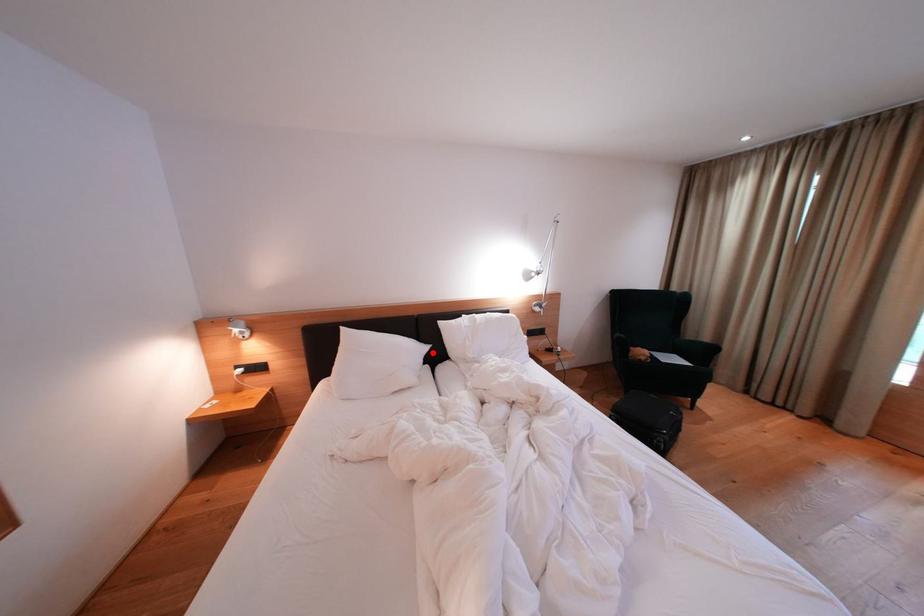
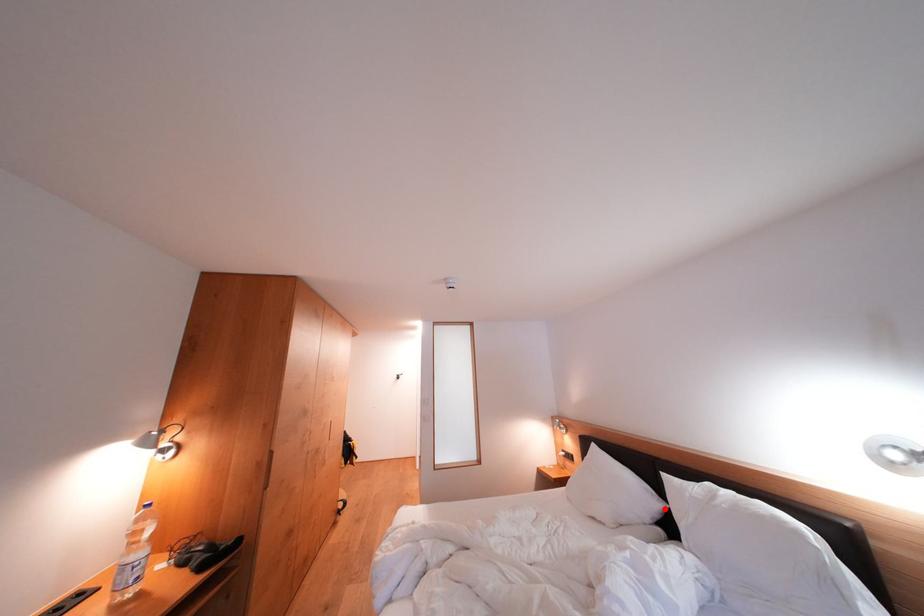
I am providing you with two images of the same scene from different viewpoints. A red point is marked on the first image and another point is marked on the second image. Is the marked point in image1 the same physical position as the marked point in image2?

Yes